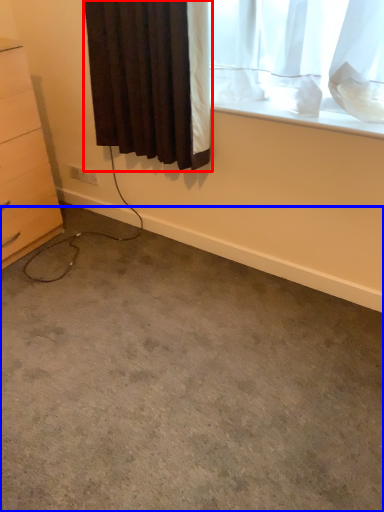
Question: Among these objects, which one is farthest to the camera, curtain (highlighted by a red box) or concrete (highlighted by a blue box)?

Choices:
 (A) curtain
 (B) concrete

Answer: (A)